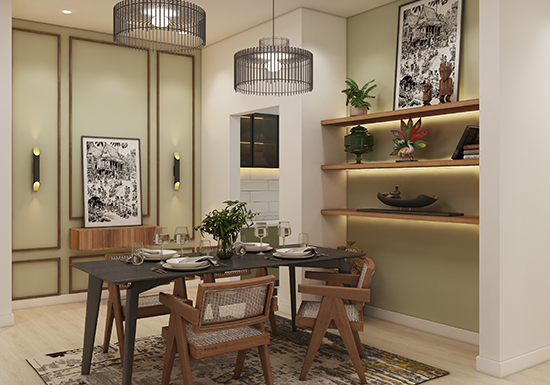
In order to click on tile wall in this screenshot , I will do `click(266, 189)`.